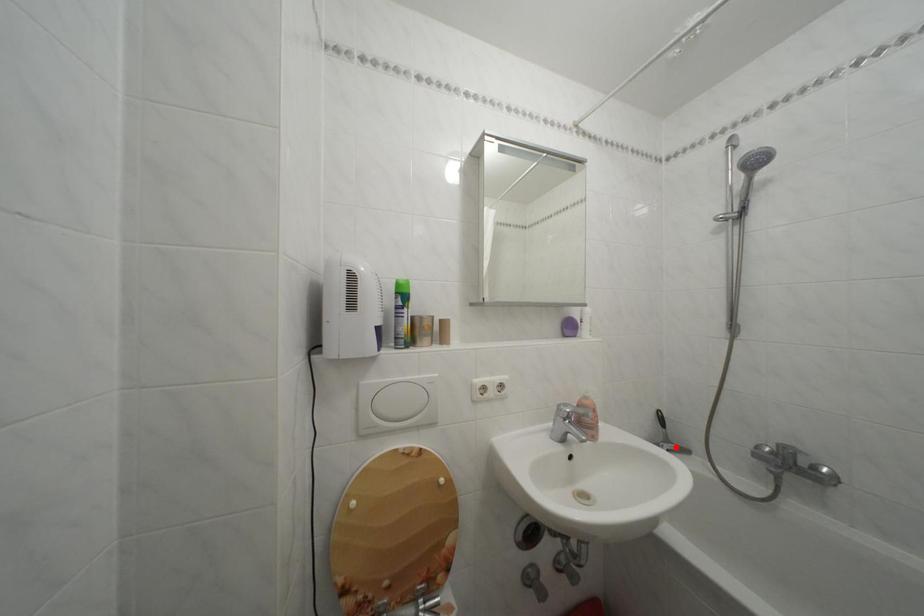
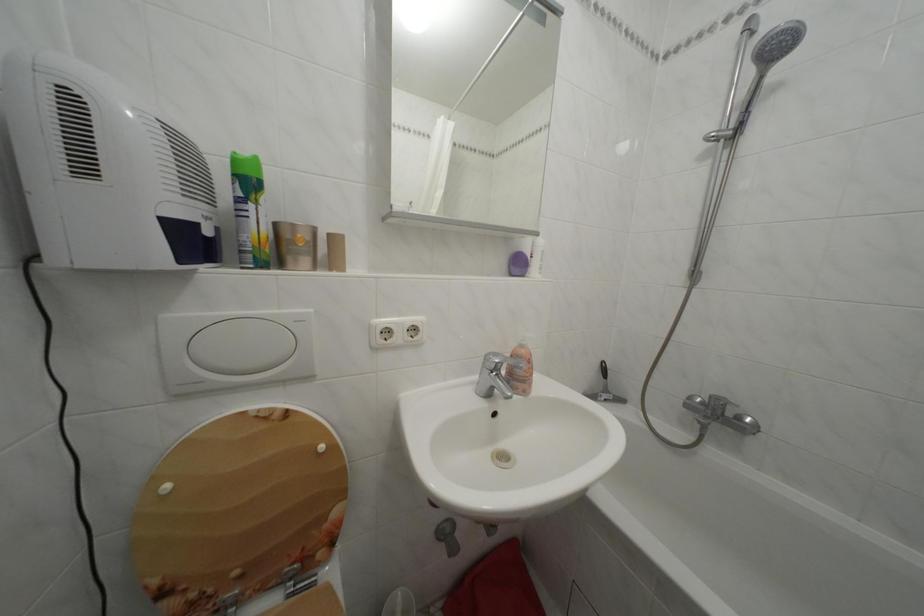
Question: I am providing you with two images of the same scene from different viewpoints. In image1, a red point is highlighted. Considering the same 3D point in image2, which of the following is correct?

Choices:
 (A) It is closer
 (B) It is farther

Answer: (B)